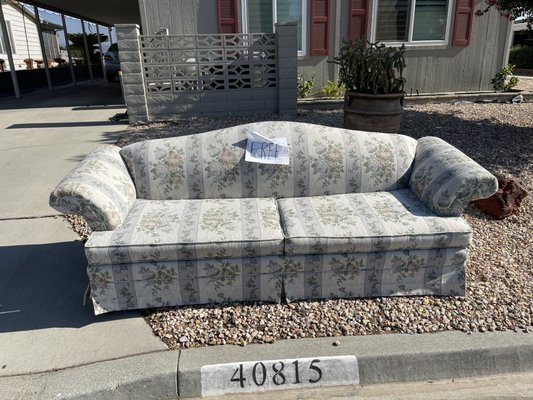
Locate an element on the screen. The height and width of the screenshot is (400, 533). the left armrest is located at coordinates pyautogui.click(x=455, y=166).